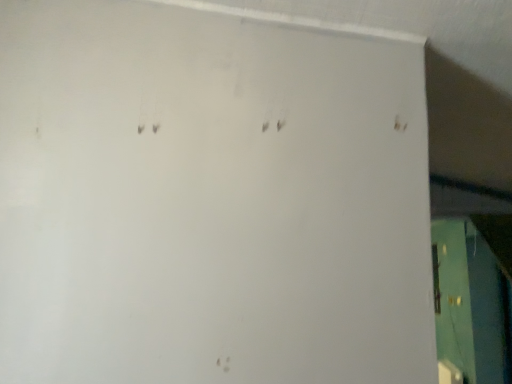
This screenshot has height=384, width=512. Identify the location of green matte door at right. (471, 303).

Describe the element at coordinates (471, 303) in the screenshot. The image size is (512, 384). I see `green matte door at right` at that location.

From the picture: Measure the distance between point (x=505, y=355) and camera.

A distance of 3.58 meters exists between point (x=505, y=355) and camera.

The height and width of the screenshot is (384, 512). What are the coordinates of `green matte door at right` in the screenshot? It's located at (471, 303).